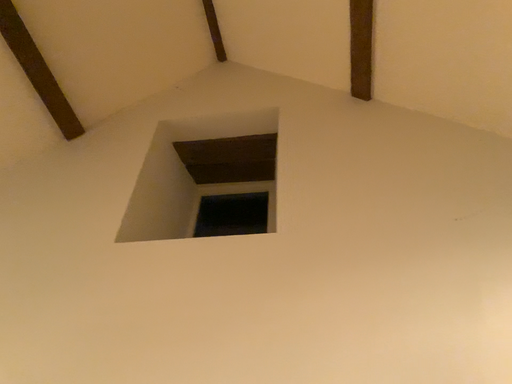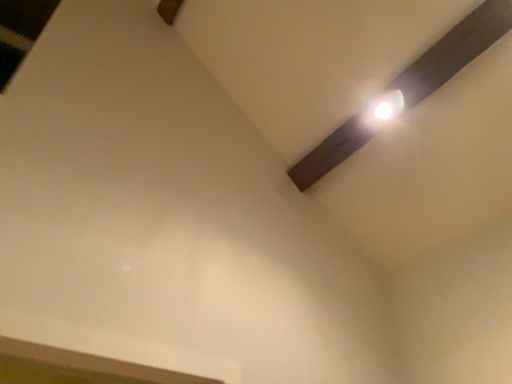
Question: How did the camera likely rotate when shooting the video?

Choices:
 (A) rotated left
 (B) rotated right

Answer: (B)